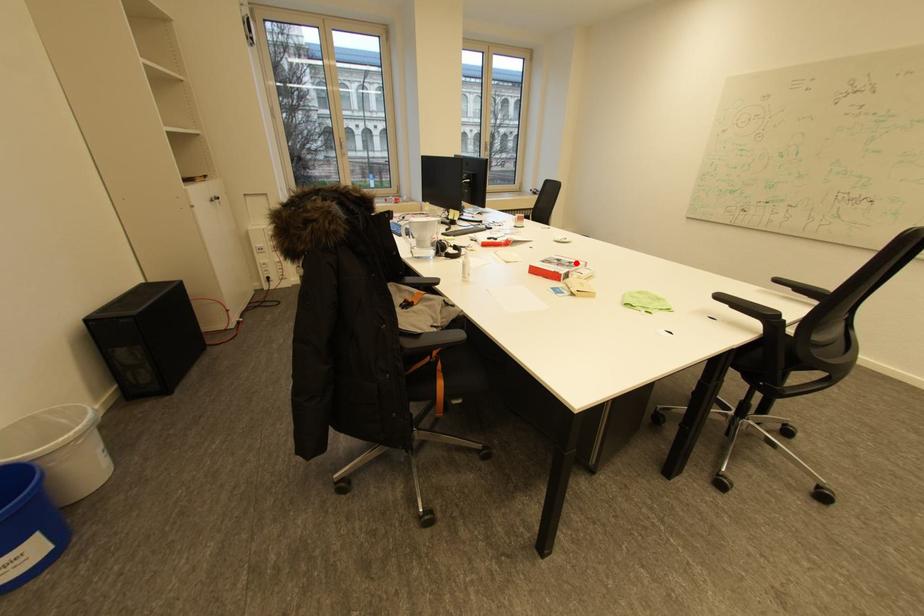
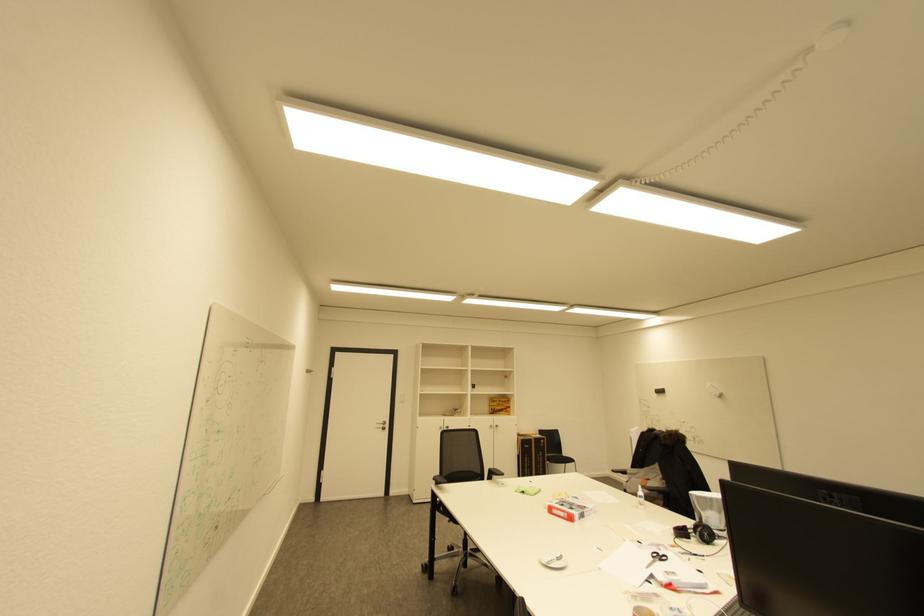
Locate, in the second image, the point that corresponds to the highlighted location in the first image.

(568, 506)